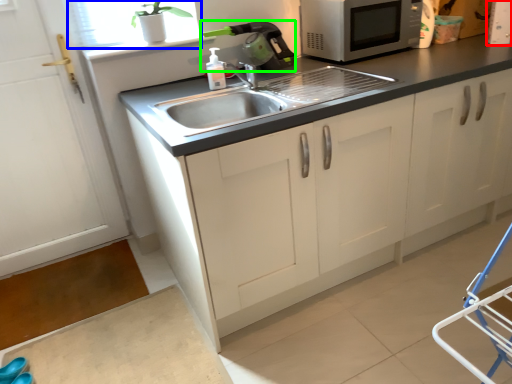
Question: Considering the real-world distances, which object is closest to appliance (highlighted by a red box)? window screen (highlighted by a blue box) or appliance (highlighted by a green box).

Choices:
 (A) window screen
 (B) appliance

Answer: (B)